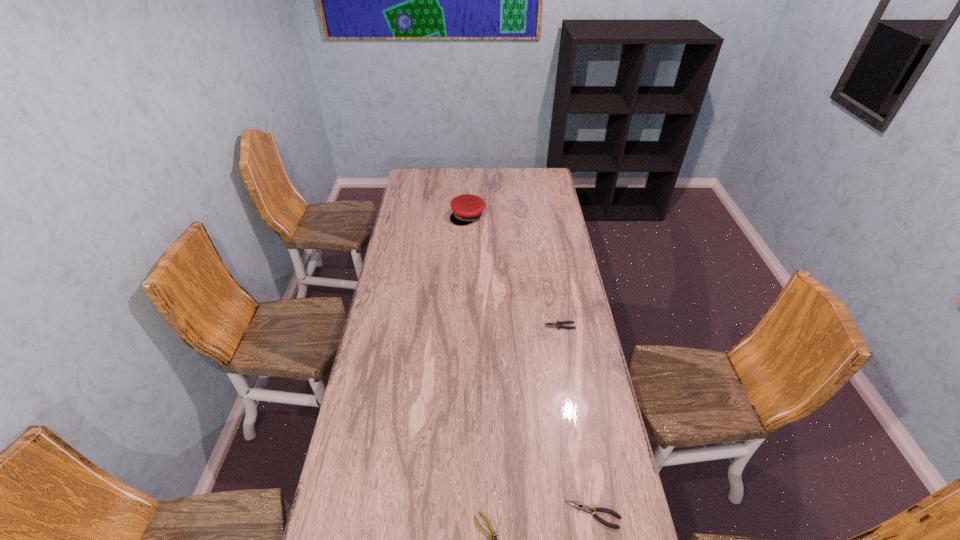
Image resolution: width=960 pixels, height=540 pixels. I want to click on object that stands as the closest to the tallest object, so click(x=557, y=324).

Locate an element on the screen. object identified as the second closest to the farthest pliers is located at coordinates (467, 208).

At what (x,y) coordinates should I click in order to perform the action: click on pliers that is the closest to the tallest object. Please return your answer as a coordinate pair (x, y). Looking at the image, I should click on (557, 324).

Where is `pliers that is the second closest to the shortest pliers`? This screenshot has width=960, height=540. pliers that is the second closest to the shortest pliers is located at coordinates (557, 324).